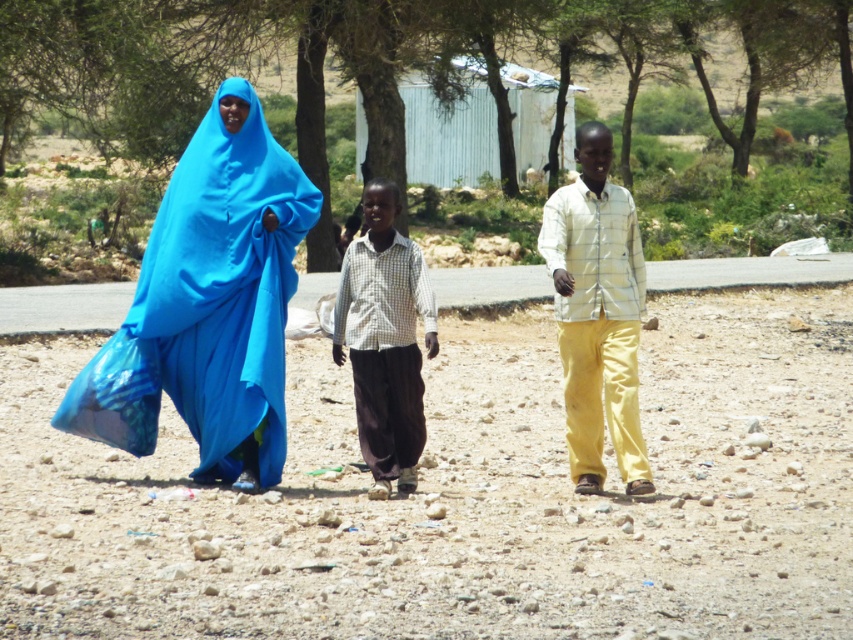
Question: Considering the real-world distances, which object is closest to the dusty gravel at center?

Choices:
 (A) white checkered shirt at center
 (B) blue fabric hijab at left
 (C) white matte shirt at center

Answer: (C)

Question: Is blue fabric hijab at left further to the viewer compared to white matte shirt at center?

Choices:
 (A) yes
 (B) no

Answer: (A)

Question: Is dusty gravel at center behind blue fabric hijab at left?

Choices:
 (A) yes
 (B) no

Answer: (B)

Question: Observing the image, what is the correct spatial positioning of blue fabric hijab at left in reference to white matte shirt at center?

Choices:
 (A) above
 (B) below

Answer: (A)

Question: Which of the following is the closest to the observer?

Choices:
 (A) dusty gravel at center
 (B) blue fabric hijab at left
 (C) white checkered shirt at center

Answer: (A)

Question: Among these objects, which one is nearest to the camera?

Choices:
 (A) white matte shirt at center
 (B) dusty gravel at center
 (C) blue fabric hijab at left
 (D) white checkered shirt at center

Answer: (B)